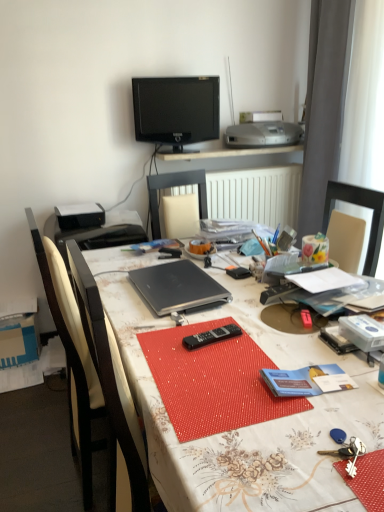
You are a GUI agent. You are given a task and a screenshot of the screen. Output one action in this format:
    pyautogui.click(x=<x>, y=<y>)
    Task: Click on the vacant area on top of black matte laptop at center (from a real-world perspective)
    Image resolution: width=384 pixels, height=512 pixels.
    Given the screenshot: What is the action you would take?
    pyautogui.click(x=176, y=280)